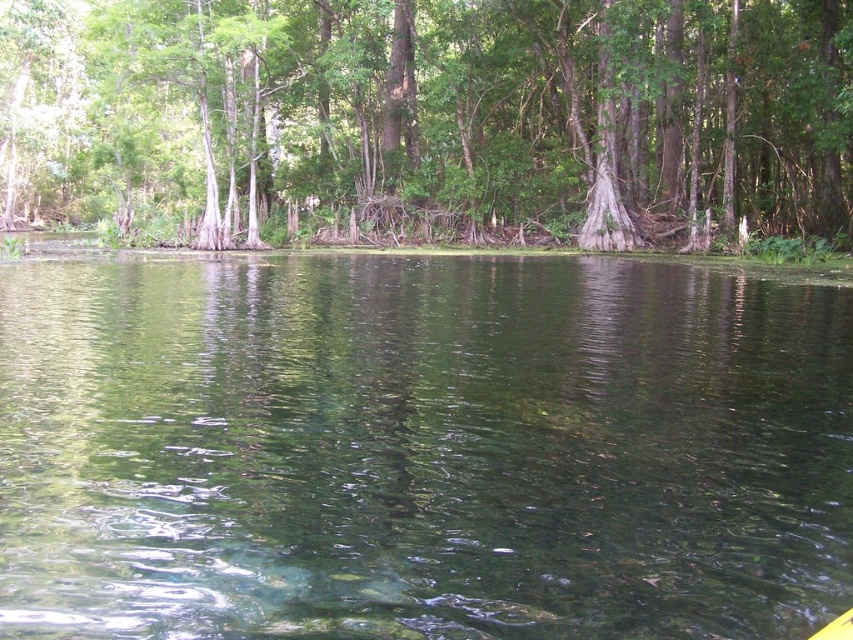
Is clear water at center thinner than green leafy tree at upper center?

Yes, clear water at center is thinner than green leafy tree at upper center.

Does clear water at center have a larger size compared to green leafy tree at upper center?

No, clear water at center is not bigger than green leafy tree at upper center.

Describe the element at coordinates (421, 449) in the screenshot. I see `clear water at center` at that location.

Locate an element on the screen. The width and height of the screenshot is (853, 640). clear water at center is located at coordinates (421, 449).